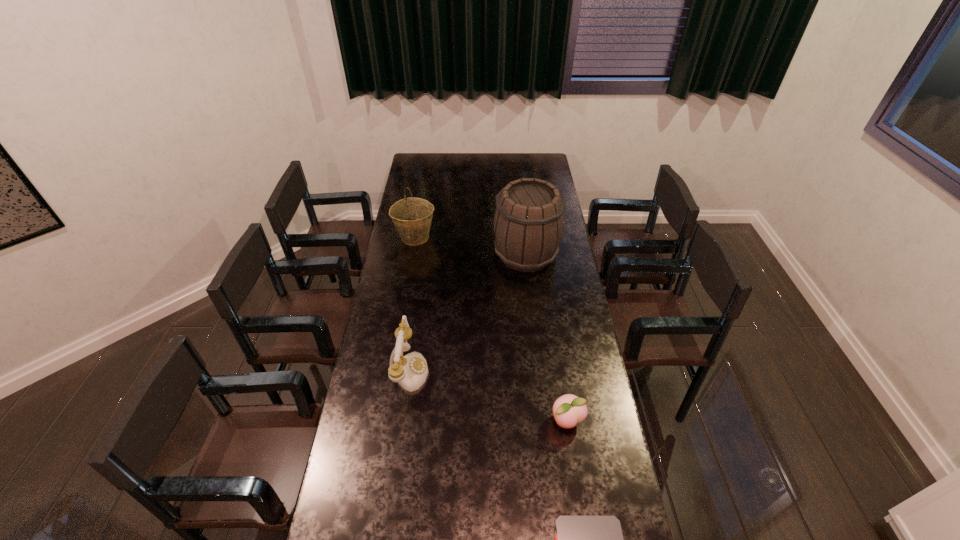
This screenshot has width=960, height=540. I want to click on vacant space positioned on the dial of the telephone, so click(x=487, y=369).

What are the coordinates of `free region located 0.360m on the left of the peach` in the screenshot? It's located at (446, 421).

This screenshot has width=960, height=540. What are the coordinates of `wine bucket at the left edge` in the screenshot? It's located at (412, 216).

Locate an element on the screen. telephone present at the left edge is located at coordinates (410, 371).

You are a GUI agent. You are given a task and a screenshot of the screen. Output one action in this format:
    pyautogui.click(x=<x>, y=<y>)
    Task: Click on the wine bucket positioned at the right edge
    This screenshot has width=960, height=540.
    Given the screenshot: What is the action you would take?
    coord(529,222)

Find the location of a particular element. peach situated at the right edge is located at coordinates (569, 410).

Locate an element on the screen. Image resolution: width=960 pixels, height=540 pixels. free region at the far edge is located at coordinates click(495, 160).

This screenshot has width=960, height=540. In the image, there is a desktop. What are the coordinates of `vacant space at the left edge` in the screenshot? It's located at (392, 260).

This screenshot has height=540, width=960. What are the coordinates of `free space at the right edge of the desktop` in the screenshot? It's located at (554, 284).

The image size is (960, 540). I want to click on vacant region at the far right corner of the desktop, so click(537, 163).